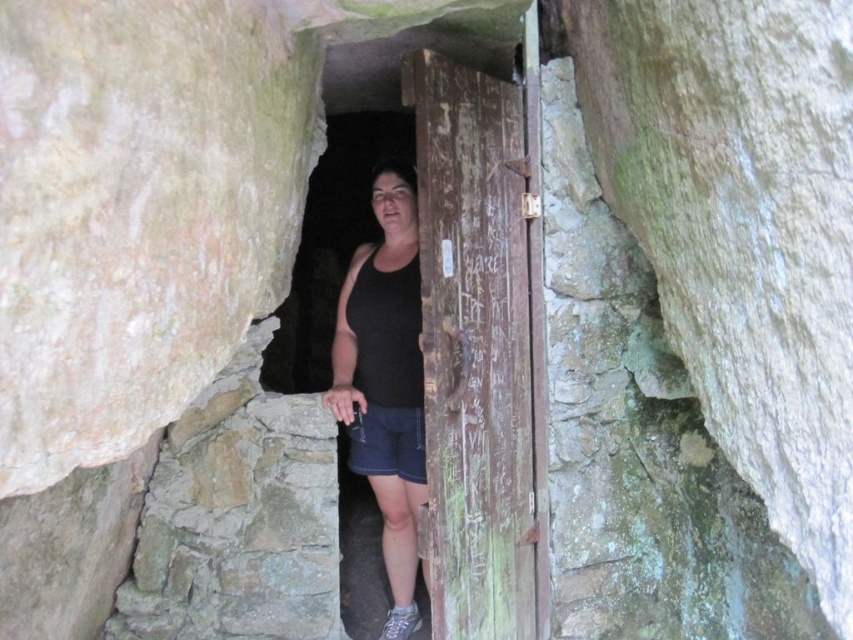
Question: Does weathered wood door at center have a smaller size compared to denim shorts at center?

Choices:
 (A) yes
 (B) no

Answer: (B)

Question: Does weathered wood door at center have a greater width compared to denim shorts at center?

Choices:
 (A) no
 (B) yes

Answer: (B)

Question: Considering the real-world distances, which object is closest to the denim shorts at center?

Choices:
 (A) black matte tank top at center
 (B) weathered wood door at center

Answer: (A)

Question: Which point appears farthest from the camera in this image?

Choices:
 (A) (358, 433)
 (B) (376, 168)

Answer: (A)

Question: Based on their relative distances, which object is nearer to the denim shorts at center?

Choices:
 (A) black matte tank top at center
 (B) weathered wood door at center

Answer: (A)

Question: Does black matte tank top at center have a lesser width compared to denim shorts at center?

Choices:
 (A) no
 (B) yes

Answer: (A)